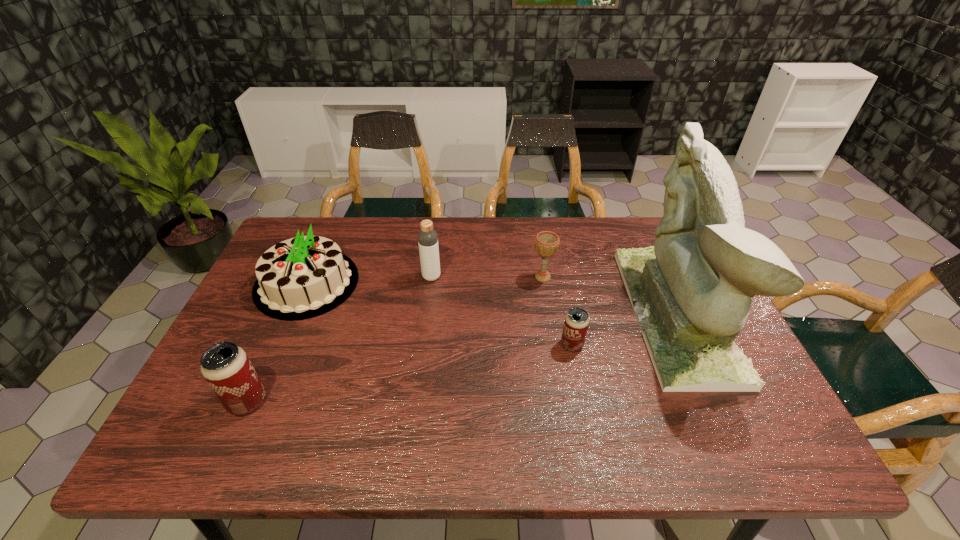
This screenshot has height=540, width=960. What are the coordinates of `free space at the far left corner of the desktop` in the screenshot? It's located at (323, 234).

In the image, there is a desktop. At what (x,y) coordinates should I click in order to perform the action: click on free space at the near left corner. Please return your answer as a coordinate pair (x, y). Image resolution: width=960 pixels, height=540 pixels. Looking at the image, I should click on (201, 416).

At what (x,y) coordinates should I click in order to perform the action: click on vacant area that lies between the birthday cake and the bottle. Please return your answer as a coordinate pair (x, y). The width and height of the screenshot is (960, 540). Looking at the image, I should click on (370, 280).

Identify the location of unoccupied position between the left beer can and the shortest object. (410, 373).

Where is `free area in between the rightmost object and the taller beer can`? The width and height of the screenshot is (960, 540). free area in between the rightmost object and the taller beer can is located at coordinates (462, 357).

Identify the location of vacant space in between the tallest object and the chalice. (610, 295).

Locate an element on the screen. The height and width of the screenshot is (540, 960). vacant area that lies between the fourth object from right to left and the chalice is located at coordinates (487, 277).

Locate an element on the screen. This screenshot has height=540, width=960. free space between the chalice and the taller beer can is located at coordinates (395, 339).

Where is `free space between the chalice and the third object from left to right`? This screenshot has height=540, width=960. free space between the chalice and the third object from left to right is located at coordinates (487, 277).

This screenshot has width=960, height=540. Identify the location of vacant area between the left beer can and the birthday cake. (277, 342).